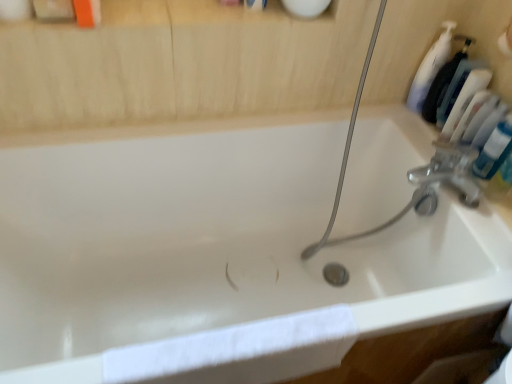
Question: In terms of size, does blue glossy tube at upper right appear bigger or smaller than white plastic bottle at upper right?

Choices:
 (A) small
 (B) big

Answer: (A)

Question: Is blue glossy tube at upper right situated inside white plastic bottle at upper right or outside?

Choices:
 (A) inside
 (B) outside

Answer: (B)

Question: Estimate the real-world distances between objects in this image. Which object is closer to the white glossy bathtub at center?

Choices:
 (A) white cotton towel at lower left
 (B) blue glossy tube at upper right
 (C) white plastic bottle at upper right

Answer: (A)

Question: Which is nearer to the blue glossy tube at upper right?

Choices:
 (A) white plastic bottle at upper right
 (B) white glossy bathtub at center
 (C) white cotton towel at lower left

Answer: (A)